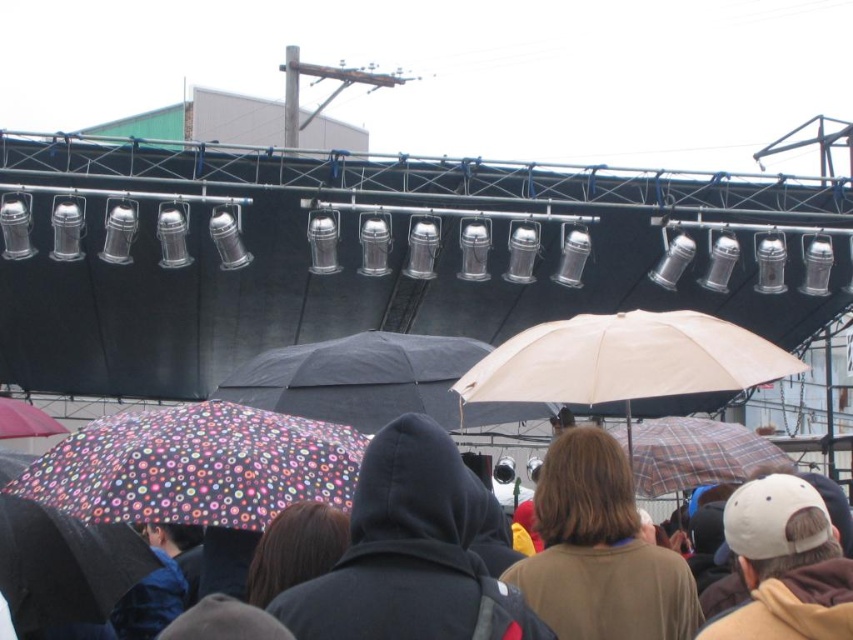
Looking at this image, between brown matte jacket at center and black matte umbrella at center, which one is positioned higher?

black matte umbrella at center

Does brown matte jacket at center come in front of black matte umbrella at center?

Yes, it is in front of black matte umbrella at center.

Find the location of `brown matte jacket at center`. brown matte jacket at center is located at coordinates tap(599, 550).

Image resolution: width=853 pixels, height=640 pixels. Identify the location of printed fabric umbrella at center. (242, 465).

Which is in front, point (389, 483) or point (659, 449)?

Point (389, 483) is more forward.

Locate an element on the screen. printed fabric umbrella at center is located at coordinates (242, 465).

Who is taller, polka dot fabric umbrella at lower left or brown matte jacket at center?

brown matte jacket at center

From the picture: Is polka dot fabric umbrella at lower left positioned before brown matte jacket at center?

Yes, polka dot fabric umbrella at lower left is closer to the viewer.

Identify the location of polka dot fabric umbrella at lower left. The image size is (853, 640). (195, 467).